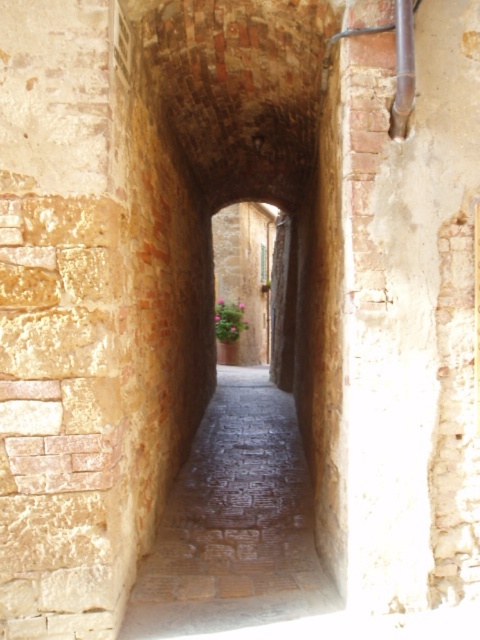
You are a delivery person carrying a large package and need to pass through the narrow alleyway. You see the brick tunnel at center and the smooth stone path at center. Which path should you take to ensure your package doesn not get damaged?

The brick tunnel at center is larger in size than the smooth stone path at center, so you should take the brick tunnel at center to accommodate your large package without damaging it.

You are navigating a narrow alleyway with two points marked on the ground. You need to move from point A to point B. If point A is at coordinates point (x=321, y=408) and point B is at coordinates point (x=184, y=532), which point should you start at to reach the other without backtracking?

You should start at point B at coordinates point (x=184, y=532) because point A at coordinates point (x=321, y=408) is behind it, so moving from B to A would allow you to reach the destination without backtracking.